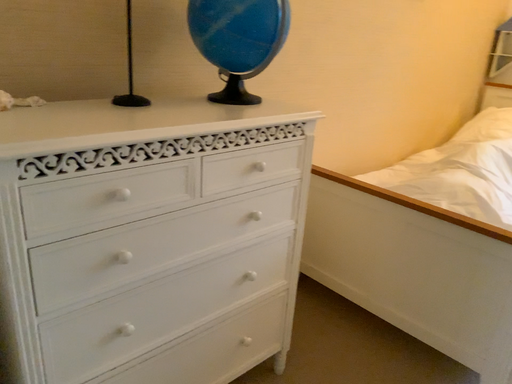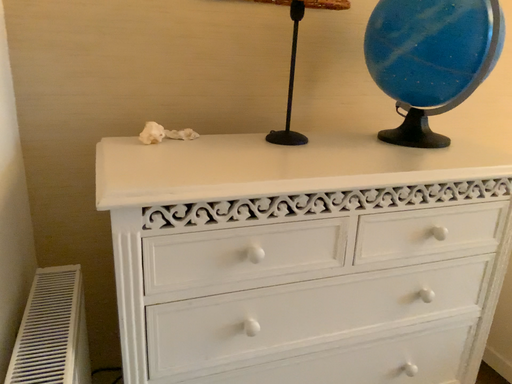
Question: Which way did the camera rotate in the video?

Choices:
 (A) rotated right
 (B) rotated left

Answer: (B)